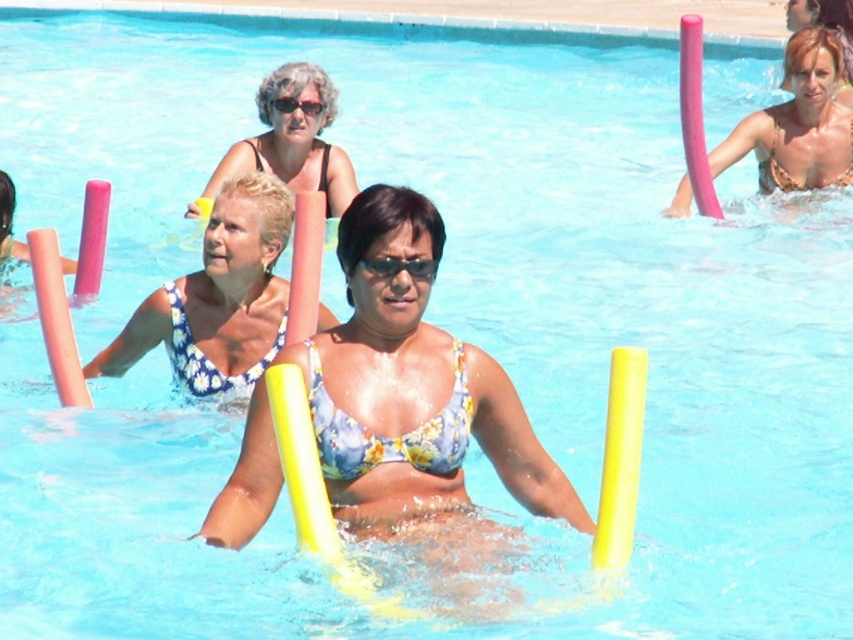
You are a photographer standing at the edge of the pool. You want to take a closeup photo of the matte black bikini top at upper center. The camera you are using has a minimum focusing distance of 1 meter. Can you take the photo without moving closer?

The distance between the matte black bikini top at upper center and the camera is 12.08 meters, which is greater than the camera minimum focusing distance of 1 meter. Therefore, you can take the photo without moving closer.

You are a photographer trying to capture a clear shot of the floral print bikini top at center and the pink foam float at upper right. Which object will appear closer to the camera in the photo?

The floral print bikini top at center will appear closer to the camera because it is in front of the pink foam float at upper right.

In the water aerobics class scene, you notice the matte black bikini top at upper center and the pink foam float at left. Which object is bigger?

The matte black bikini top at upper center is larger in size than the pink foam float at left.